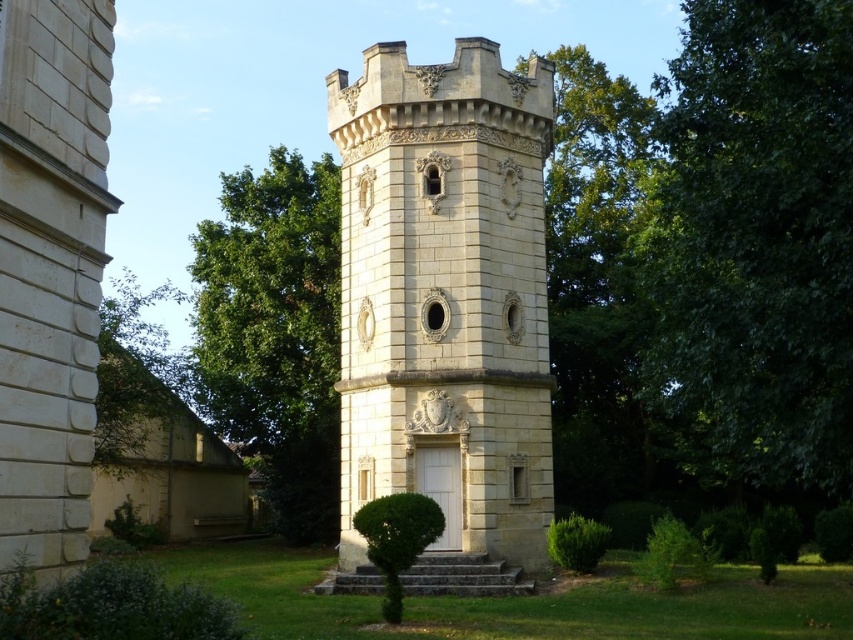
Does white stone tower at center have a larger size compared to green leafy tree at center?

No, white stone tower at center is not bigger than green leafy tree at center.

Which of these two, white stone tower at center or green leafy tree at center, stands shorter?

white stone tower at center is shorter.

Find the location of a particular element. The image size is (853, 640). white stone tower at center is located at coordinates (445, 310).

Identify the location of white stone tower at center. (445, 310).